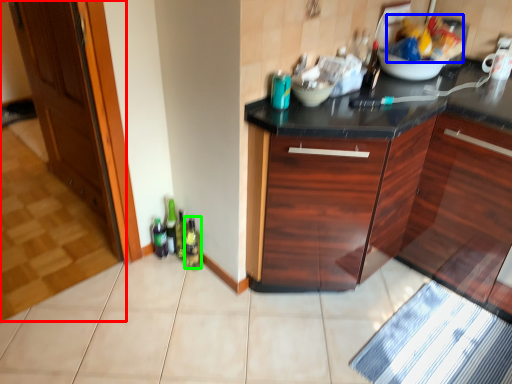
Question: Based on their relative distances, which object is farther from door (highlighted by a red box)? Choose from food (highlighted by a blue box) and bottle (highlighted by a green box).

Choices:
 (A) food
 (B) bottle

Answer: (A)